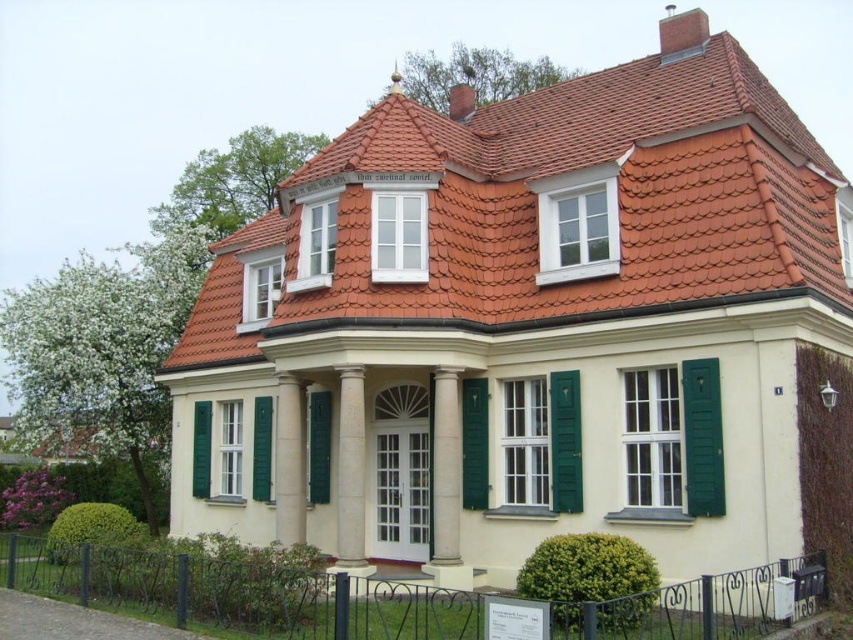
You are an architect evaluating the symmetry of the house. Given that the white smooth column at center and the green matte shutter at left are part of the facade, which object occupies more space in the design?

The white smooth column at center occupies more space in the design because it is larger in size than the green matte shutter at left.

You are a window cleaner standing on the ground in front of the house. You need to clean both the terracotta clay tiles at upper center and the green matte shutter at center. Which object is taller so you can prioritize cleaning the taller one first?

→ The terracotta clay tiles at upper center has a greater height compared to the green matte shutter at center, so you should prioritize cleaning the terracotta clay tiles at upper center first.

You are a painter who needs to decide which object to paint first. The white smooth column at center and the green matte shutter at left are both in your view. Based on their widths, which one should you start with if you want to paint the wider one first?

The white smooth column at center might be wider than green matte shutter at left, so you should start painting the white smooth column at center first.